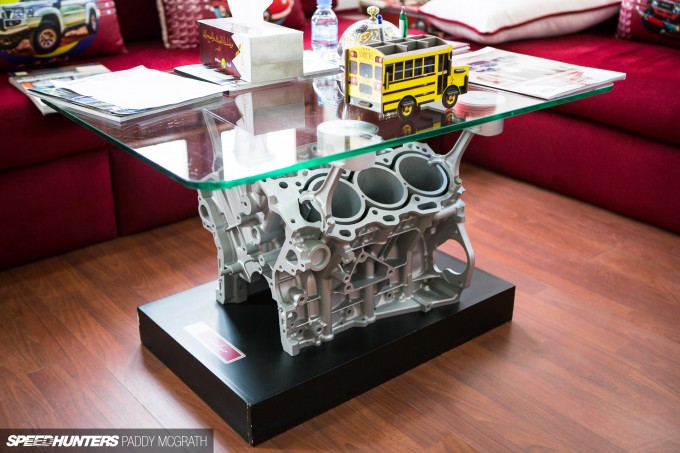
Locate an element on the screen. bottle is located at coordinates (326, 31).